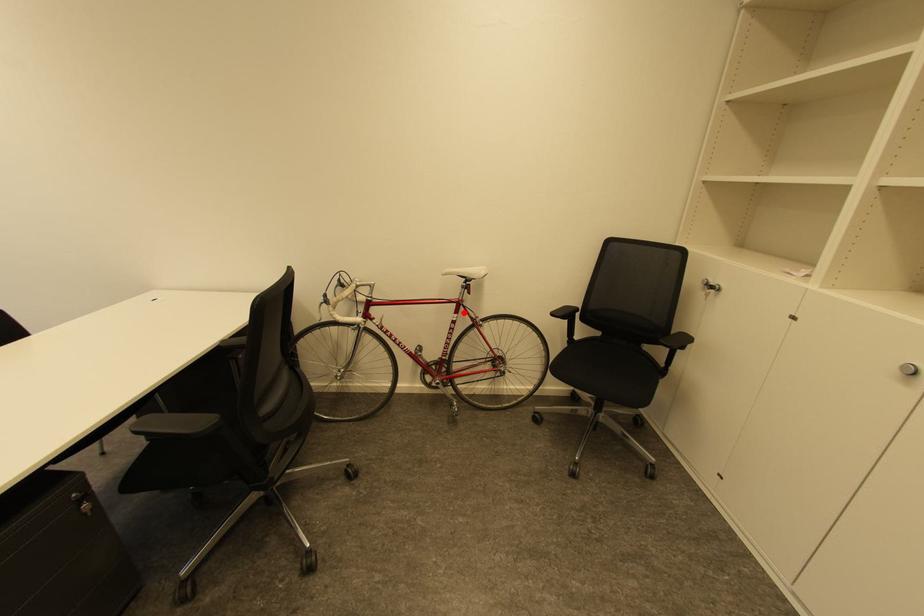
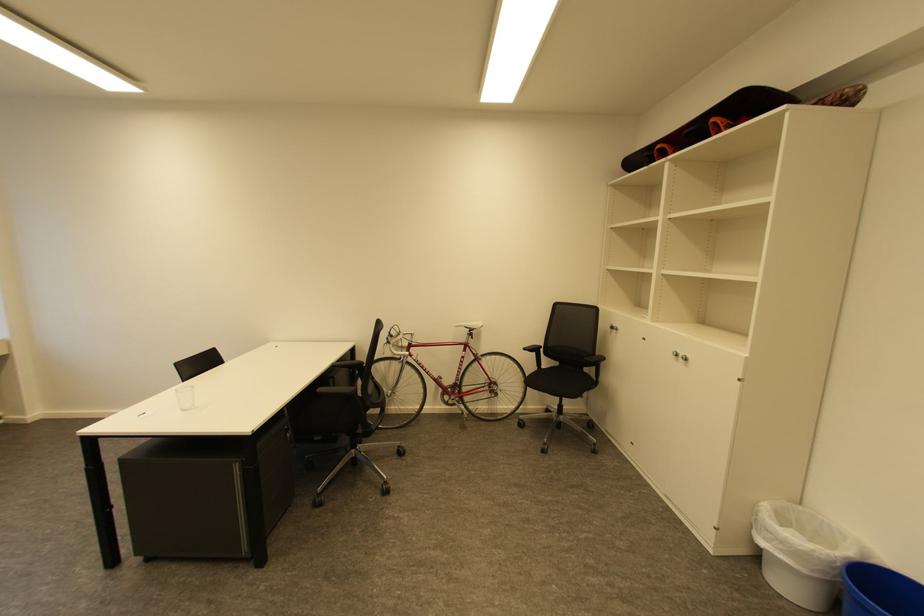
Locate, in the second image, the point that corresponds to the highlighted location in the first image.

(471, 351)